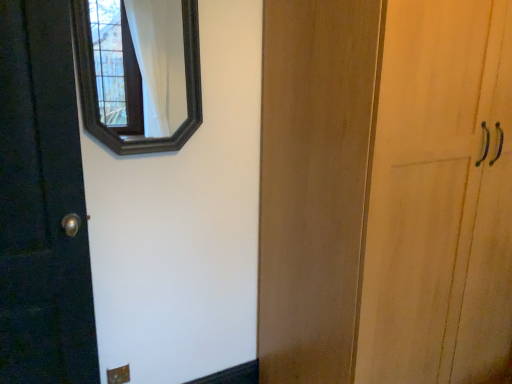
Question: Should I look upward or downward to see dark gray wooden mirror at upper left?

Choices:
 (A) up
 (B) down

Answer: (A)